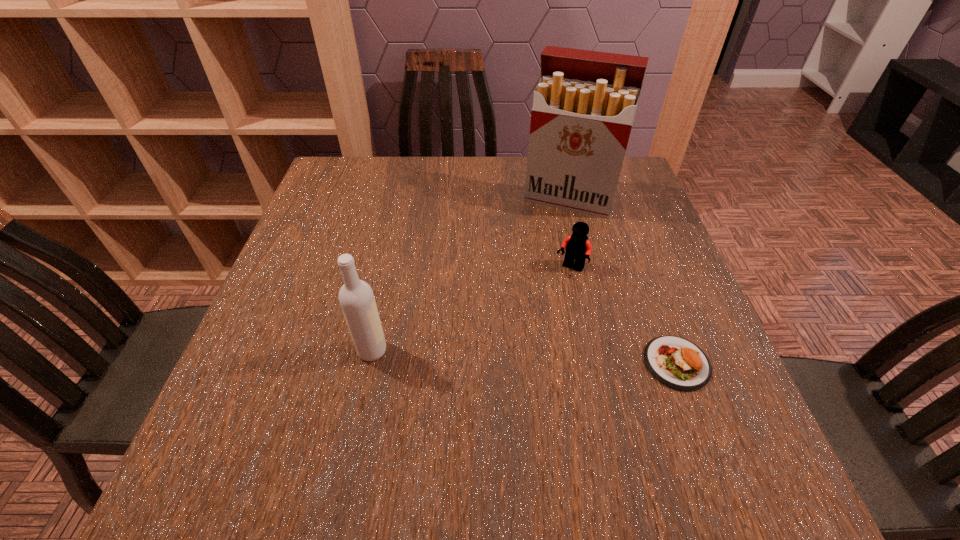
Locate an element on the screen. The width and height of the screenshot is (960, 540). vacant region between the patty (food) and the second tallest object is located at coordinates (524, 357).

Where is `blank region between the farthest object and the vodka`? The height and width of the screenshot is (540, 960). blank region between the farthest object and the vodka is located at coordinates (470, 275).

This screenshot has height=540, width=960. I want to click on free spot between the farthest object and the third tallest object, so click(x=570, y=234).

At what (x,y) coordinates should I click in order to perform the action: click on free spot between the second shortest object and the tallest object. Please return your answer as a coordinate pair (x, y). The height and width of the screenshot is (540, 960). Looking at the image, I should click on (570, 234).

Identify the location of free spot between the leftmost object and the shortest object. The image size is (960, 540). (524, 357).

This screenshot has width=960, height=540. What are the coordinates of `free space between the leftmost object and the patty (food)` in the screenshot? It's located at 524,357.

Select which object appears as the closest to the cigarette case. Please provide its 2D coordinates. Your answer should be formatted as a tuple, i.e. [(x, y)], where the tuple contains the x and y coordinates of a point satisfying the conditions above.

[(577, 246)]

Identify which object is the third closest to the tallest object. Please provide its 2D coordinates. Your answer should be formatted as a tuple, i.e. [(x, y)], where the tuple contains the x and y coordinates of a point satisfying the conditions above.

[(356, 297)]

This screenshot has width=960, height=540. Identify the location of free region that satisfies the following two spatial constraints: 1. on the back side of the vodka; 2. on the left side of the cigarette case. (404, 199).

Where is `vacant space that satisfies the following two spatial constraints: 1. on the front side of the leftmost object; 2. on the right side of the patty (food)`? This screenshot has height=540, width=960. vacant space that satisfies the following two spatial constraints: 1. on the front side of the leftmost object; 2. on the right side of the patty (food) is located at coordinates (370, 363).